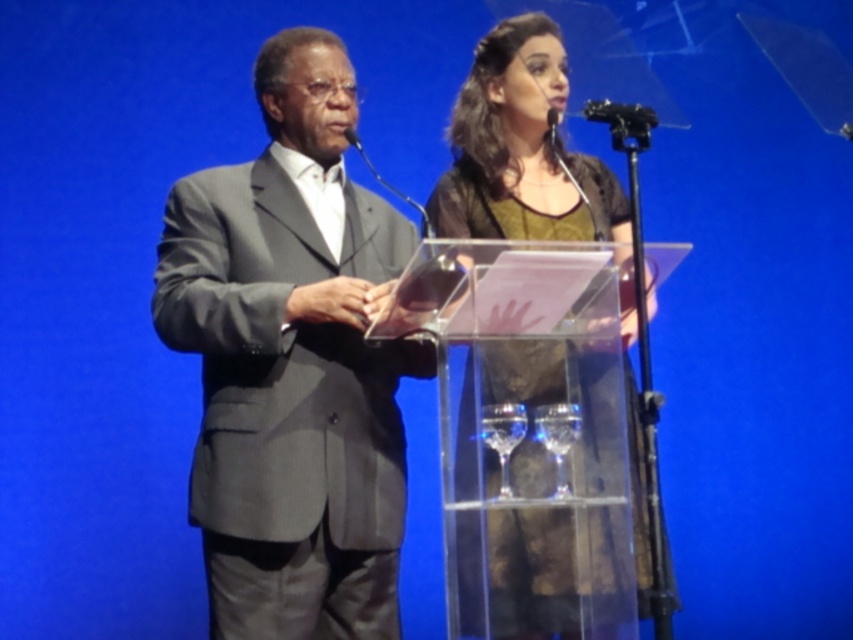
You are an event planner trying to arrange a small gift for each speaker. The gift box is 20 cm wide. The speakers are wearing the matte brown dress at center and holding the black plastic microphone at upper center. Which item requires a wider space for storage?

The matte brown dress at center requires a wider space for storage because its width is larger than the black plastic microphone at upper center.

You are an event coordinator and need to adjust the stage setup. The matte brown dress at center belongs to a guest speaker who needs to move closer to the black plastic microphone at upper center. Based on their current positions, which direction should the guest speaker move to get closer to the microphone?

The matte brown dress at center is to the right of the black plastic microphone at upper center, so the guest speaker should move to the left to get closer to the microphone.

You are an event planner observing the stage setup. You need to place a decorative banner between the gray suit at left and the matte brown dress at center. Based on their positions, which side of the banner should be closer to the audience?

The gray suit at left is in front of the matte brown dress at center, so the banner should be placed closer to the gray suit at left to maintain visibility for the audience.